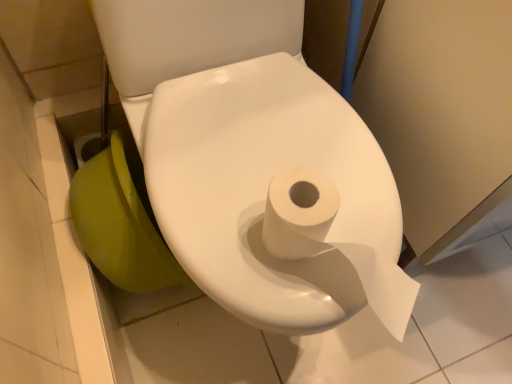
Describe the element at coordinates (120, 225) in the screenshot. I see `green glossy toilet bowl at lower left` at that location.

Locate an element on the screen. green glossy toilet bowl at lower left is located at coordinates (120, 225).

Identify the location of white matte toilet paper at center. (267, 195).

What do you see at coordinates (267, 195) in the screenshot? This screenshot has height=384, width=512. I see `white matte toilet paper at center` at bounding box center [267, 195].

Locate an element on the screen. The image size is (512, 384). green glossy toilet bowl at lower left is located at coordinates (120, 225).

Which object is positioned more to the right, white matte toilet paper at center or green glossy toilet bowl at lower left?

From the viewer's perspective, white matte toilet paper at center appears more on the right side.

Which object is further away from the camera taking this photo, white matte toilet paper at center or green glossy toilet bowl at lower left?

green glossy toilet bowl at lower left is behind.

Considering the points (199, 185) and (137, 284), which point is in front, point (199, 185) or point (137, 284)?

Positioned in front is point (199, 185).

From the image's perspective, between white matte toilet paper at center and green glossy toilet bowl at lower left, which one is located above?

white matte toilet paper at center is shown above in the image.

From a real-world perspective, is white matte toilet paper at center physically above green glossy toilet bowl at lower left?

Yes, from a real-world perspective, white matte toilet paper at center is over green glossy toilet bowl at lower left

Considering the sizes of objects white matte toilet paper at center and green glossy toilet bowl at lower left in the image provided, who is wider, white matte toilet paper at center or green glossy toilet bowl at lower left?

white matte toilet paper at center.

Is white matte toilet paper at center taller or shorter than green glossy toilet bowl at lower left?

white matte toilet paper at center is taller than green glossy toilet bowl at lower left.

Considering the sizes of white matte toilet paper at center and green glossy toilet bowl at lower left in the image, is white matte toilet paper at center bigger or smaller than green glossy toilet bowl at lower left?

In the image, white matte toilet paper at center appears to be larger than green glossy toilet bowl at lower left.

Consider the image. Is green glossy toilet bowl at lower left inside white matte toilet paper at center?

That's incorrect, green glossy toilet bowl at lower left is not inside white matte toilet paper at center.

Would you consider white matte toilet paper at center to be distant from green glossy toilet bowl at lower left?

No, white matte toilet paper at center is not far away from green glossy toilet bowl at lower left.

Is white matte toilet paper at center oriented away from green glossy toilet bowl at lower left?

white matte toilet paper at center is not turned away from green glossy toilet bowl at lower left.

Consider the image. How much distance is there between white matte toilet paper at center and green glossy toilet bowl at lower left?

They are 8.90 inches apart.

Identify the location of toilet bowl behind the white matte toilet paper at center. (120, 225).

Which object is positioned more to the left, green glossy toilet bowl at lower left or white matte toilet paper at center?

From the viewer's perspective, green glossy toilet bowl at lower left appears more on the left side.

Considering the positions of objects green glossy toilet bowl at lower left and white matte toilet paper at center in the image provided, who is in front, green glossy toilet bowl at lower left or white matte toilet paper at center?

white matte toilet paper at center is in front.

Between point (149, 284) and point (294, 154), which one is positioned behind?

The point (149, 284) is behind.

From the image's perspective, which is below, green glossy toilet bowl at lower left or white matte toilet paper at center?

green glossy toilet bowl at lower left.

From a real-world perspective, is green glossy toilet bowl at lower left physically located above or below white matte toilet paper at center?

green glossy toilet bowl at lower left is situated lower than white matte toilet paper at center in the real world.

Which of these two, green glossy toilet bowl at lower left or white matte toilet paper at center, is wider?

Wider between the two is white matte toilet paper at center.

Is green glossy toilet bowl at lower left taller than white matte toilet paper at center?

Incorrect, the height of green glossy toilet bowl at lower left is not larger of that of white matte toilet paper at center.

Is green glossy toilet bowl at lower left bigger or smaller than white matte toilet paper at center?

Clearly, green glossy toilet bowl at lower left is smaller in size than white matte toilet paper at center.

Is white matte toilet paper at center completely or partially inside green glossy toilet bowl at lower left?

Actually, white matte toilet paper at center is outside green glossy toilet bowl at lower left.

Is green glossy toilet bowl at lower left beside white matte toilet paper at center?

No, green glossy toilet bowl at lower left is not next to white matte toilet paper at center.

Is green glossy toilet bowl at lower left facing away from white matte toilet paper at center?

green glossy toilet bowl at lower left is not turned away from white matte toilet paper at center.

How many degrees apart are the facing directions of green glossy toilet bowl at lower left and white matte toilet paper at center?

3.38e-05 degrees separate the facing orientations of green glossy toilet bowl at lower left and white matte toilet paper at center.

This screenshot has width=512, height=384. In the image, there is a white matte toilet paper at center. Find the location of `toilet bowl below it (from the image's perspective)`. toilet bowl below it (from the image's perspective) is located at coordinates (120, 225).

In the image, there is a green glossy toilet bowl at lower left. Identify the location of toilet above it (from the image's perspective). Image resolution: width=512 pixels, height=384 pixels. [267, 195].

You are a GUI agent. You are given a task and a screenshot of the screen. Output one action in this format:
    pyautogui.click(x=<x>, y=<y>)
    Task: Click on the toilet bowl behind the white matte toilet paper at center
    Image resolution: width=512 pixels, height=384 pixels.
    Given the screenshot: What is the action you would take?
    pyautogui.click(x=120, y=225)